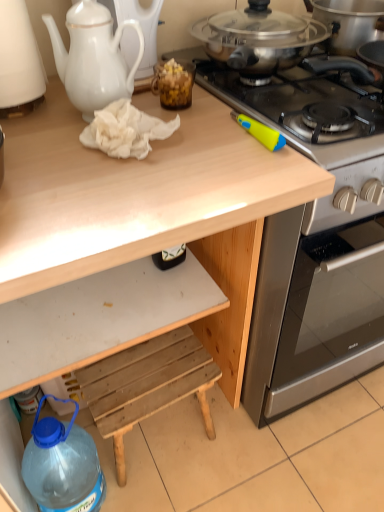
Where is `translucent brown jar at upper center`? This screenshot has height=512, width=384. translucent brown jar at upper center is located at coordinates (174, 83).

Find the location of a particular element. The height and width of the screenshot is (512, 384). white porcelain teapot at upper left is located at coordinates [93, 57].

This screenshot has height=512, width=384. Find the location of `white ceramic teapot at upper left`. white ceramic teapot at upper left is located at coordinates (19, 61).

Locate an element on the screen. stainless steel gas stove at upper right is located at coordinates (301, 108).

The width and height of the screenshot is (384, 512). In order to click on stainless steel oven at right in this screenshot , I will do `click(315, 301)`.

What's the angular difference between white ceramic teapot at upper left and translucent brown jar at upper center's facing directions?

There is a 1.28-degree angle between the facing directions of white ceramic teapot at upper left and translucent brown jar at upper center.

Considering the relative sizes of white ceramic teapot at upper left and translucent brown jar at upper center in the image provided, is white ceramic teapot at upper left bigger than translucent brown jar at upper center?

Yes, white ceramic teapot at upper left is bigger than translucent brown jar at upper center.

Is white ceramic teapot at upper left at the left side of translucent brown jar at upper center?

Yes, white ceramic teapot at upper left is to the left of translucent brown jar at upper center.

From a real-world perspective, which object rests below the other?

translucent brown jar at upper center is physically lower.

Can you confirm if blue translucent bottle at lower left is taller than white porcelain teapot at upper left?

Yes.

Can you tell me how much blue translucent bottle at lower left and white porcelain teapot at upper left differ in facing direction?

3.05 degrees separate the facing orientations of blue translucent bottle at lower left and white porcelain teapot at upper left.

Looking at their sizes, would you say blue translucent bottle at lower left is wider or thinner than white porcelain teapot at upper left?

In the image, blue translucent bottle at lower left appears to be wider than white porcelain teapot at upper left.

Looking at the image, does blue translucent bottle at lower left seem bigger or smaller compared to white porcelain teapot at upper left?

In the image, blue translucent bottle at lower left appears to be larger than white porcelain teapot at upper left.

Does white ceramic teapot at upper left turn towards white porcelain teapot at upper left?

No.

From a real-world perspective, who is located lower, white ceramic teapot at upper left or white porcelain teapot at upper left?

white ceramic teapot at upper left.

From the image's perspective, is white ceramic teapot at upper left positioned above or below white porcelain teapot at upper left?

From the image's perspective, white ceramic teapot at upper left appears above white porcelain teapot at upper left.

What's the angular difference between white ceramic teapot at upper left and white porcelain teapot at upper left's facing directions?

white ceramic teapot at upper left and white porcelain teapot at upper left are facing 1.17 degrees away from each other.

Between wooden step stool at lower center and stainless steel oven at right, which one appears on the right side from the viewer's perspective?

stainless steel oven at right.

From a real-world perspective, is wooden step stool at lower center under stainless steel oven at right?

Yes, from a real-world perspective, wooden step stool at lower center is below stainless steel oven at right.

Is wooden step stool at lower center inside or outside of stainless steel oven at right?

wooden step stool at lower center cannot be found inside stainless steel oven at right.

How different are the orientations of wooden step stool at lower center and stainless steel oven at right in degrees?

2.65 degrees separate the facing orientations of wooden step stool at lower center and stainless steel oven at right.

Which is more distant, [171,94] or [191,354]?

The point [191,354] is behind.

What's the angular difference between translucent brown jar at upper center and wooden step stool at lower center's facing directions?

The angle between the facing direction of translucent brown jar at upper center and the facing direction of wooden step stool at lower center is 2.65 degrees.

Considering the sizes of objects translucent brown jar at upper center and wooden step stool at lower center in the image provided, who is wider, translucent brown jar at upper center or wooden step stool at lower center?

With larger width is wooden step stool at lower center.

The height and width of the screenshot is (512, 384). I want to click on food above the wooden step stool at lower center (from a real-world perspective), so click(174, 83).

Are translucent brown jar at upper center and stainless steel oven at right located far from each other?

They are positioned close to each other.

Does translucent brown jar at upper center have a greater height compared to stainless steel oven at right?

Incorrect, the height of translucent brown jar at upper center is not larger of that of stainless steel oven at right.

Is translucent brown jar at upper center positioned beyond the bounds of stainless steel oven at right?

Indeed, translucent brown jar at upper center is completely outside stainless steel oven at right.

Is white matte drawer at lower center taller than wooden step stool at lower center?

Correct, white matte drawer at lower center is much taller as wooden step stool at lower center.

Considering the relative positions of white matte drawer at lower center and wooden step stool at lower center in the image provided, is white matte drawer at lower center in front of wooden step stool at lower center?

Yes, it is.

From a real-world perspective, is white matte drawer at lower center positioned over wooden step stool at lower center based on gravity?

Yes.

In the image, there is a white ceramic teapot at upper left. Identify the location of food below it (from a real-world perspective). (174, 83).

Locate an element on the screen. The width and height of the screenshot is (384, 512). bottle that appears below the white porcelain teapot at upper left (from the image's perspective) is located at coordinates click(62, 465).

When comparing their distances from white matte drawer at lower center, does stainless steel oven at right or translucent brown jar at upper center seem further?

translucent brown jar at upper center.

When comparing their distances from blue translucent bottle at lower left, does white ceramic teapot at upper left or stainless steel oven at right seem closer?

Based on the image, stainless steel oven at right appears to be nearer to blue translucent bottle at lower left.

Looking at this image, which object lies nearer to the anchor point white porcelain teapot at upper left, translucent brown jar at upper center or stainless steel oven at right?

translucent brown jar at upper center lies closer to white porcelain teapot at upper left than the other object.

Looking at the image, which one is located closer to white matte drawer at lower center, wooden step stool at lower center or translucent brown jar at upper center?

Among the two, wooden step stool at lower center is located nearer to white matte drawer at lower center.

When comparing their distances from blue translucent bottle at lower left, does wooden step stool at lower center or translucent brown jar at upper center seem closer?

wooden step stool at lower center is closer to blue translucent bottle at lower left.

When comparing their distances from translucent brown jar at upper center, does stainless steel gas stove at upper right or white ceramic teapot at upper left seem further?

white ceramic teapot at upper left is further to translucent brown jar at upper center.

Looking at the image, which one is located closer to stainless steel oven at right, stainless steel gas stove at upper right or white ceramic teapot at upper left?

Based on the image, stainless steel gas stove at upper right appears to be nearer to stainless steel oven at right.

Looking at the image, which one is located further to white ceramic teapot at upper left, white matte drawer at lower center or blue translucent bottle at lower left?

Among the two, blue translucent bottle at lower left is located further to white ceramic teapot at upper left.

Find the location of a particular element. The image size is (384, 512). food between white porcelain teapot at upper left and blue translucent bottle at lower left in the up-down direction is located at coordinates (174, 83).

At what (x,y) coordinates should I click in order to perform the action: click on step stool that lies between white ceramic teapot at upper left and blue translucent bottle at lower left from top to bottom. Please return your answer as a coordinate pair (x, y). The image size is (384, 512). Looking at the image, I should click on (146, 385).

Where is `gas stove between white porcelain teapot at upper left and white matte drawer at lower center in the vertical direction`? gas stove between white porcelain teapot at upper left and white matte drawer at lower center in the vertical direction is located at coordinates (301, 108).

Identify the location of food between stainless steel gas stove at upper right and blue translucent bottle at lower left in the vertical direction. (174, 83).